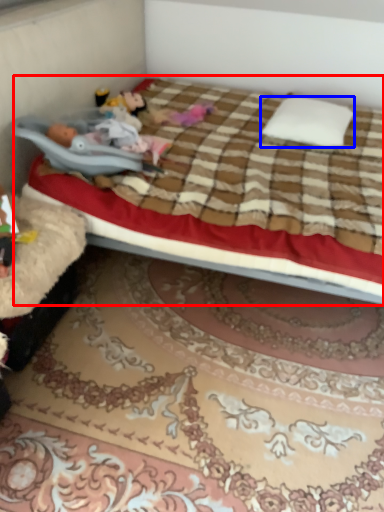
Question: Among these objects, which one is nearest to the camera, bed (highlighted by a red box) or pillow (highlighted by a blue box)?

Choices:
 (A) bed
 (B) pillow

Answer: (A)